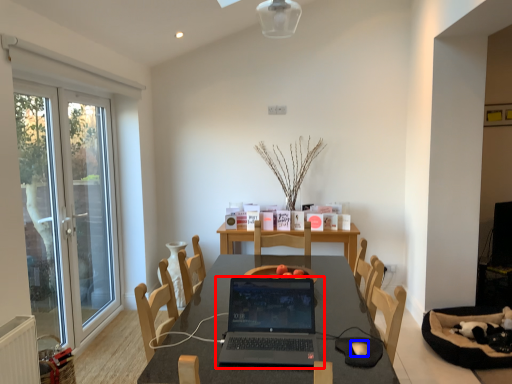
Question: Which of the following is the farthest to the observer, laptop (highlighted by a red box) or mouse (highlighted by a blue box)?

Choices:
 (A) laptop
 (B) mouse

Answer: (B)